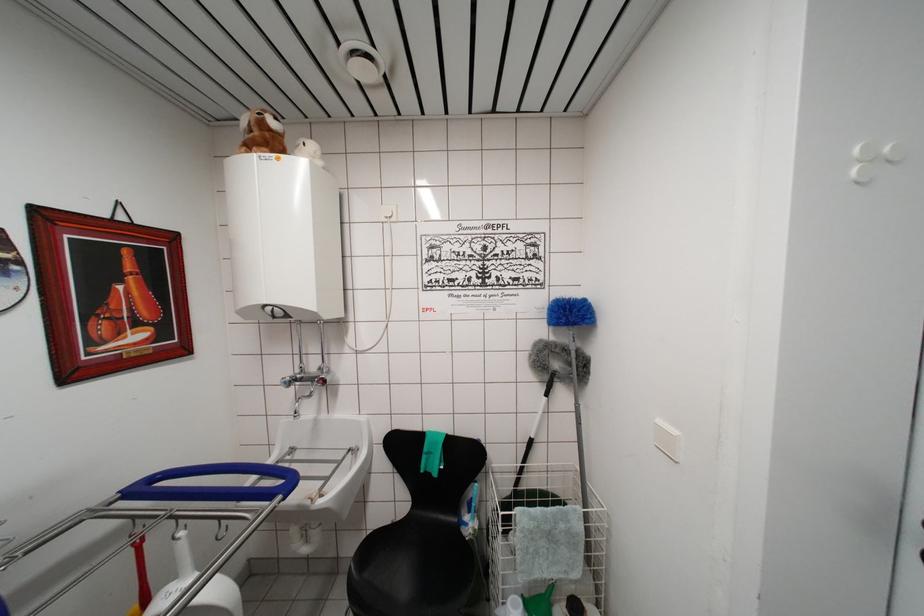
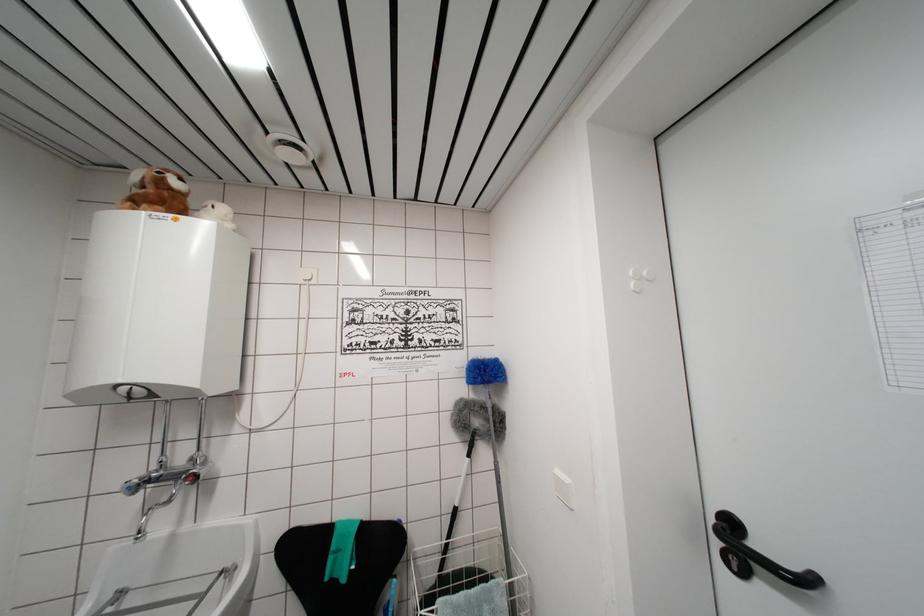
Question: The camera is either moving clockwise (left) or counter-clockwise (right) around the object. The first image is from the beginning of the video and the second image is from the end. Is the camera moving left or right when shooting the video?

Choices:
 (A) Left
 (B) Right

Answer: (A)